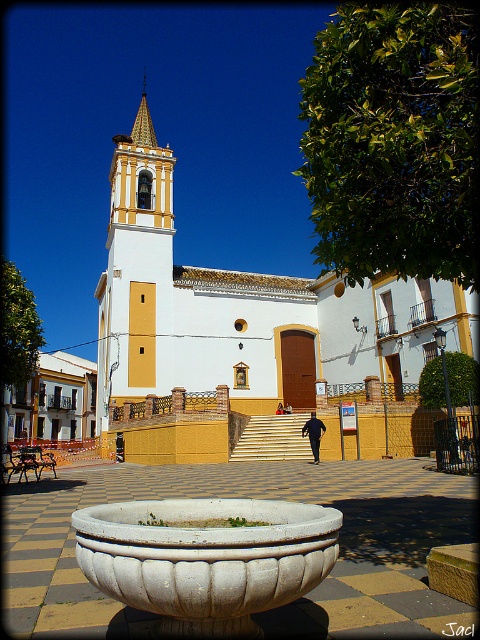
Looking at this image, how much distance is there between white stone bowl at center and dark blue fabric man at center?

white stone bowl at center and dark blue fabric man at center are 114.14 feet apart from each other.

Between white stone bowl at center and dark blue fabric man at center, which one appears on the left side from the viewer's perspective?

Positioned to the left is white stone bowl at center.

Measure the distance between point [334,556] and camera.

They are 18.11 meters apart.

Identify the location of white stone bowl at center. (205, 557).

Is white stone planter at center shorter than dark blue fabric man at center?

Yes, white stone planter at center is shorter than dark blue fabric man at center.

Is white stone planter at center above dark blue fabric man at center?

No, white stone planter at center is not above dark blue fabric man at center.

Image resolution: width=480 pixels, height=640 pixels. What do you see at coordinates (256, 497) in the screenshot?
I see `white stone planter at center` at bounding box center [256, 497].

Locate an element on the screen. white stone planter at center is located at coordinates (256, 497).

Is white stucco church at center positioned behind white stone bowl at center?

Yes, it is.

Who is more forward, [140,182] or [159,545]?

Point [159,545] is more forward.

Find the location of a particular element. Image resolution: width=480 pixels, height=640 pixels. white stucco church at center is located at coordinates (240, 316).